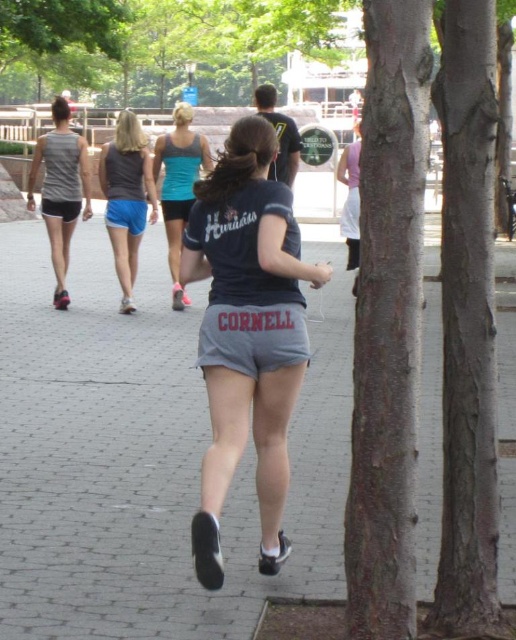
Question: Which of the following is the farthest from the observer?

Choices:
 (A) gray matte shorts at center
 (B) teal fabric tank top at center
 (C) matte gray shorts at center

Answer: (C)

Question: Does gray matte shorts at center appear under teal fabric tank top at center?

Choices:
 (A) yes
 (B) no

Answer: (A)

Question: Which point is closer to the camera?

Choices:
 (A) teal fabric tank top at center
 (B) matte gray tank top at left
 (C) gray matte shorts at center
 (D) gray concrete pavement at center

Answer: (C)

Question: From the image, what is the correct spatial relationship of matte gray shorts at center in relation to matte gray tank top at left?

Choices:
 (A) left
 (B) right

Answer: (B)

Question: Which of these objects is positioned farthest from the teal fabric tank top at center?

Choices:
 (A) gray concrete pavement at center
 (B) matte gray shorts at center
 (C) gray matte shorts at center
 (D) matte gray tank top at left

Answer: (C)

Question: Is gray concrete pavement at center bigger than matte gray shorts at center?

Choices:
 (A) no
 (B) yes

Answer: (B)